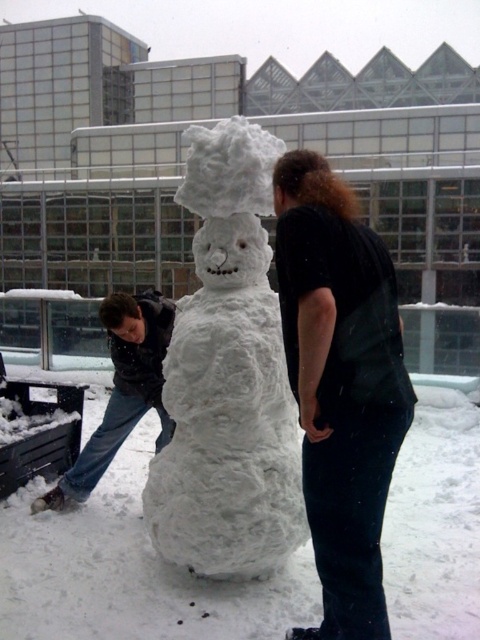
Question: Which point is farther to the camera?

Choices:
 (A) dark gray jacket at left
 (B) black matte vest at center

Answer: (A)

Question: Does white fluffy snowman at center lie in front of black matte vest at center?

Choices:
 (A) no
 (B) yes

Answer: (A)

Question: Where is white fluffy snowman at center located in relation to black matte vest at center in the image?

Choices:
 (A) above
 (B) below

Answer: (A)

Question: Which of the following is the farthest from the observer?

Choices:
 (A) (319, 250)
 (B) (68, 500)

Answer: (B)

Question: Which point is farther to the camera?

Choices:
 (A) black matte vest at center
 (B) white fluffy snowman at center

Answer: (B)

Question: Is white fluffy snowman at center below dark gray jacket at left?

Choices:
 (A) yes
 (B) no

Answer: (B)